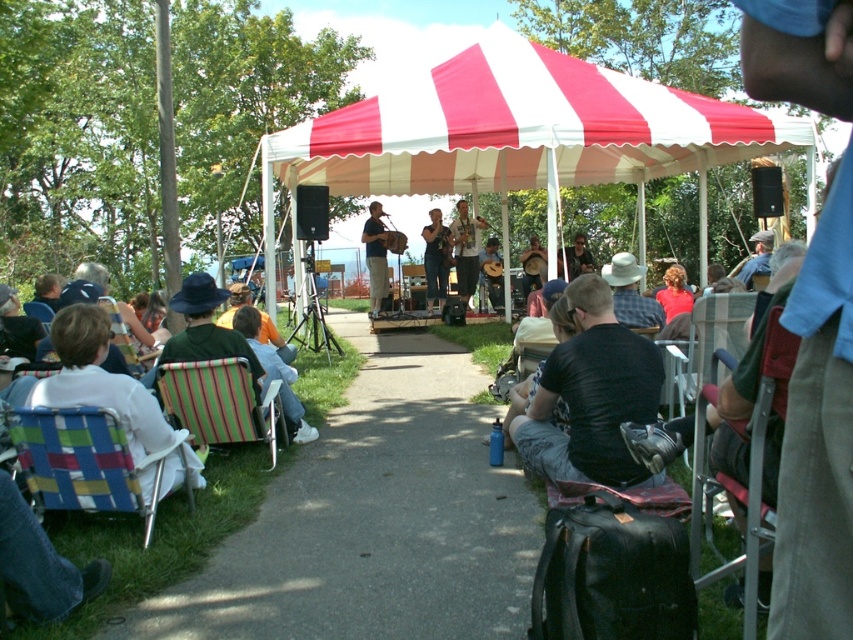
Question: Is red and white striped canopy at upper center further to the viewer compared to multicolored woven fabric chair at lower left?

Choices:
 (A) no
 (B) yes

Answer: (B)

Question: Considering the real-world distances, which object is farthest from the plaid fabric shirt at center?

Choices:
 (A) metallic silver chair at center
 (B) green striped folding chair at lower left
 (C) denim shorts at stage center
 (D) multicolored woven fabric chair at lower left

Answer: (C)

Question: Which point appears closest to the camera in this image?

Choices:
 (A) (526, 38)
 (B) (132, 348)

Answer: (B)

Question: Considering the real-world distances, which object is farthest from the black cotton shirt at center?

Choices:
 (A) concrete pavement at center
 (B) plaid fabric shirt at center
 (C) plaid fabric chair at lower left

Answer: (C)

Question: Can you confirm if matte brown banjo at center is bigger than wooden acoustic guitar at center?

Choices:
 (A) no
 (B) yes

Answer: (B)

Question: Does plaid fabric shirt at center have a greater width compared to denim shorts at stage center?

Choices:
 (A) no
 (B) yes

Answer: (A)